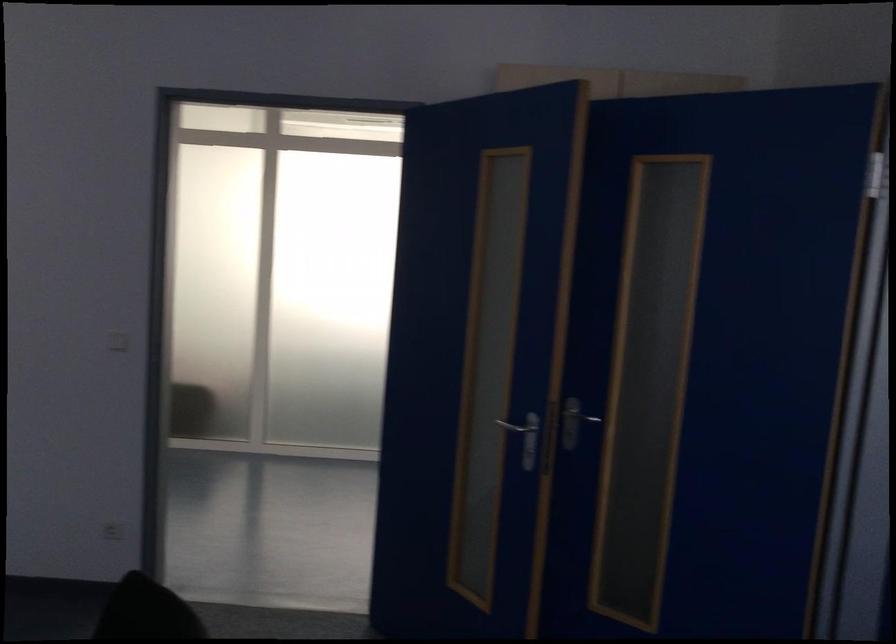
You are a GUI agent. You are given a task and a screenshot of the screen. Output one action in this format:
    pyautogui.click(x=<x>, y=<y>)
    Task: Click on the white light switch
    
    Given the screenshot: What is the action you would take?
    pyautogui.click(x=112, y=531)